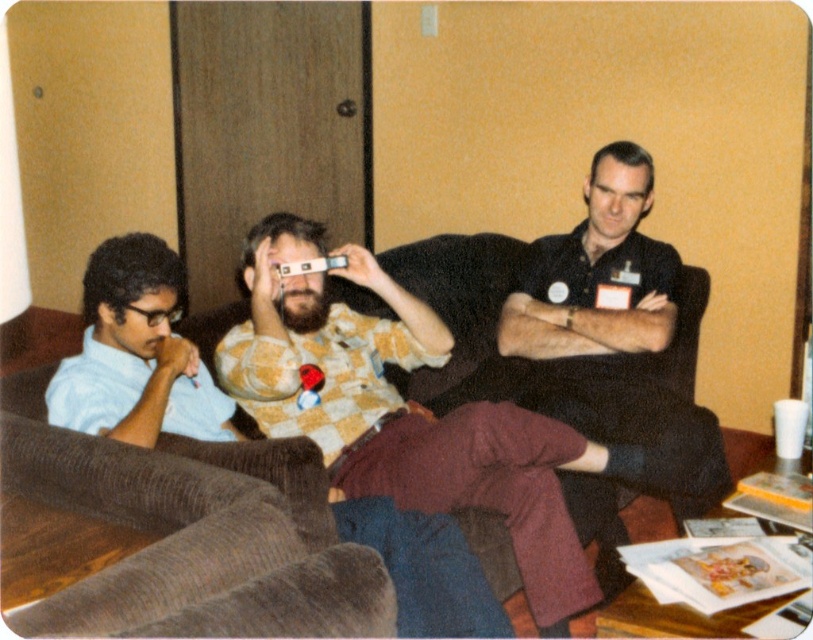
You are a furniture designer who wants to create a new couch that matches the size of the light blue shirt at left. Given that the brown fabric couch at center is currently larger, what adjustment should you make to the new couch design?

The brown fabric couch at center has a larger size compared to light blue shirt at left, so to match the light blue shirt at left, the new couch should be made smaller in size.

You are a photographer trying to capture a candid shot of the black matte shirt at center and the light blue shirt at left. Based on their positions, which shirt should you focus on first to ensure both are in frame?

The black matte shirt at center is above the light blue shirt at left, so you should focus on the light blue shirt at left first to ensure both are in frame.